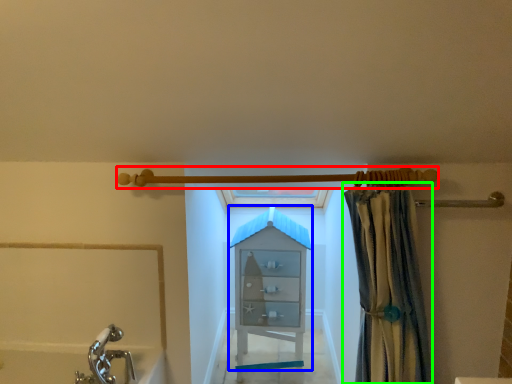
Question: Which object is positioned farthest from shower (highlighted by a red box)? Select from cabinet (highlighted by a blue box) and curtain (highlighted by a green box).

Choices:
 (A) cabinet
 (B) curtain

Answer: (A)